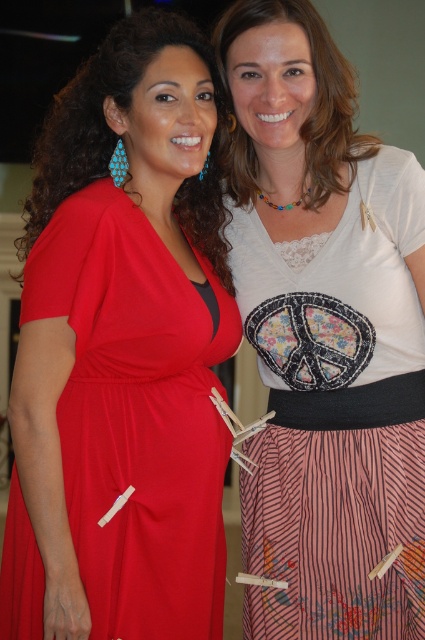
Is matte red dress at left above white lace top at center?

Actually, matte red dress at left is below white lace top at center.

Is matte red dress at left wider than white lace top at center?

Yes.

Is point (42, 241) behind point (323, 365)?

No, it is not.

I want to click on matte red dress at left, so click(x=121, y=355).